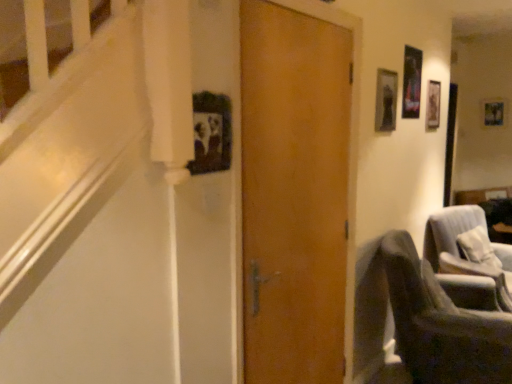
Question: From their relative heights in the image, would you say wooden photo frame at upper right, the first picture frame when ordered from back to front, is taller or shorter than velvet gray armchair at lower right, which is the 2th chair from front to back?

Choices:
 (A) short
 (B) tall

Answer: (A)

Question: In terms of width, does wooden photo frame at upper right, placed as the 1th picture frame when sorted from top to bottom, look wider or thinner when compared to velvet gray armchair at lower right, which is the 2th chair from front to back?

Choices:
 (A) wide
 (B) thin

Answer: (B)

Question: Estimate the real-world distances between objects in this image. Which object is farther from the velvet gray armchair at lower right, which is the 2th chair from front to back?

Choices:
 (A) dark gray fabric chair at lower right, acting as the second chair starting from the back
 (B) metallic silver picture frame at upper right, placed as the 2th picture frame when sorted from back to front
 (C) wooden photo frame at upper right, which is the 2th picture frame from front to back
 (D) wooden door at center

Answer: (C)

Question: Which is farther from the wooden door at center?

Choices:
 (A) metallic silver picture frame at upper right, placed as the 2th picture frame when sorted from back to front
 (B) velvet gray armchair at lower right, the 1th chair positioned from the back
 (C) wooden photo frame at upper right, which is the 2th picture frame from front to back
 (D) dark gray fabric chair at lower right, which ranks as the 1th chair in front-to-back order

Answer: (C)